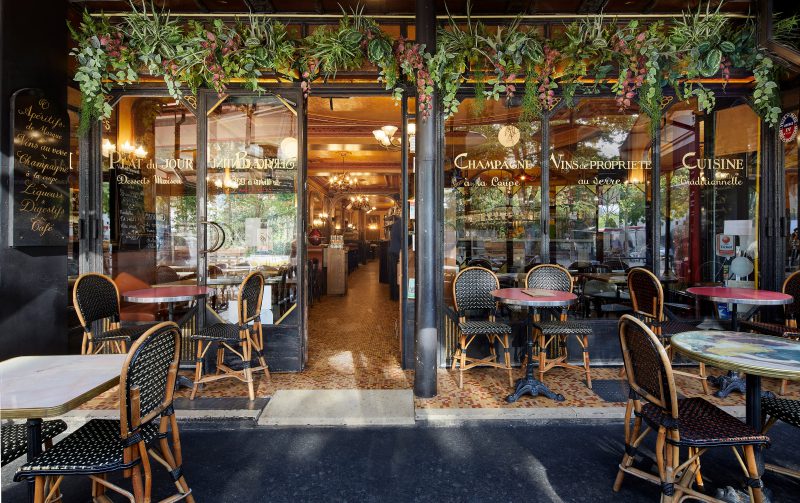
Where is `dining chairs`? dining chairs is located at coordinates (152, 365), (13, 438), (98, 297), (252, 300), (465, 291), (550, 276), (640, 297), (654, 370), (781, 407), (794, 287).